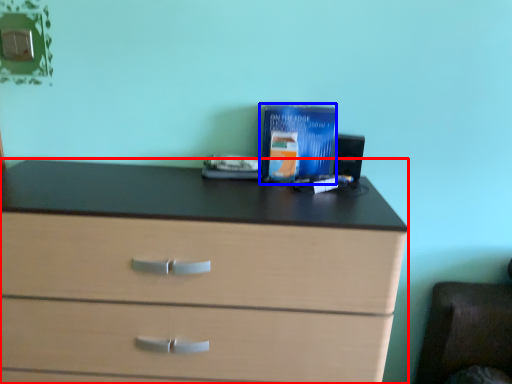
Question: Among these objects, which one is farthest to the camera, chest of drawers (highlighted by a red box) or paperback book (highlighted by a blue box)?

Choices:
 (A) chest of drawers
 (B) paperback book

Answer: (B)